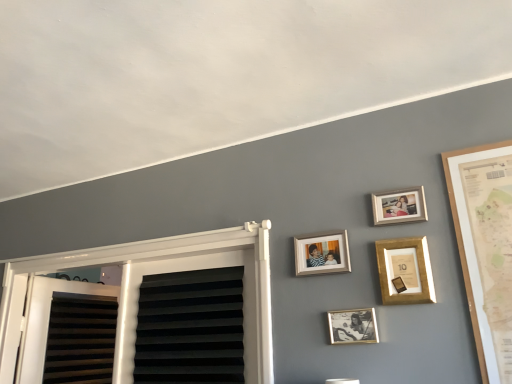
Question: Is gold-framed photo at center, arranged as the 4th picture frame when viewed from the top, positioned behind wooden photo frame at upper right, acting as the first picture frame starting from the top?

Choices:
 (A) yes
 (B) no

Answer: (B)

Question: Considering the relative positions of gold-framed photo at center, acting as the first picture frame starting from the bottom, and wooden photo frame at upper right, placed as the 4th picture frame when sorted from bottom to top, in the image provided, is gold-framed photo at center, acting as the first picture frame starting from the bottom, to the right of wooden photo frame at upper right, placed as the 4th picture frame when sorted from bottom to top, from the viewer's perspective?

Choices:
 (A) no
 (B) yes

Answer: (A)

Question: From the image's perspective, is gold-framed photo at center, arranged as the 4th picture frame when viewed from the top, located beneath wooden photo frame at upper right, placed as the 4th picture frame when sorted from bottom to top?

Choices:
 (A) no
 (B) yes

Answer: (B)

Question: Is gold-framed photo at center, acting as the first picture frame starting from the bottom, smaller than wooden photo frame at upper right, placed as the 4th picture frame when sorted from bottom to top?

Choices:
 (A) no
 (B) yes

Answer: (B)

Question: From a real-world perspective, is gold-framed photo at center, acting as the first picture frame starting from the bottom, below wooden photo frame at upper right, acting as the first picture frame starting from the top?

Choices:
 (A) yes
 (B) no

Answer: (A)

Question: Is point (333, 246) positioned closer to the camera than point (404, 216)?

Choices:
 (A) closer
 (B) farther

Answer: (B)

Question: Considering their positions, is wooden photo frame at center, the 2th picture frame when ordered from top to bottom, located in front of or behind wooden photo frame at upper right, acting as the first picture frame starting from the top?

Choices:
 (A) front
 (B) behind

Answer: (B)

Question: From the image's perspective, is wooden photo frame at center, placed as the 3th picture frame when sorted from bottom to top, above or below wooden photo frame at upper right, acting as the first picture frame starting from the top?

Choices:
 (A) below
 (B) above

Answer: (A)

Question: In the image, is wooden photo frame at center, placed as the 3th picture frame when sorted from bottom to top, on the left side or the right side of wooden photo frame at upper right, placed as the 4th picture frame when sorted from bottom to top?

Choices:
 (A) right
 (B) left

Answer: (B)

Question: Is gold metallic picture frame at upper center, acting as the second picture frame starting from the bottom, in front of or behind gold-framed photo at center, acting as the first picture frame starting from the bottom, in the image?

Choices:
 (A) behind
 (B) front

Answer: (B)

Question: Is point (419, 271) positioned closer to the camera than point (371, 309)?

Choices:
 (A) closer
 (B) farther

Answer: (A)

Question: Is gold metallic picture frame at upper center, acting as the second picture frame starting from the bottom, bigger or smaller than gold-framed photo at center, arranged as the 4th picture frame when viewed from the top?

Choices:
 (A) small
 (B) big

Answer: (B)

Question: Is gold metallic picture frame at upper center, which is counted as the third picture frame, starting from the top, inside the boundaries of gold-framed photo at center, acting as the first picture frame starting from the bottom, or outside?

Choices:
 (A) inside
 (B) outside

Answer: (B)

Question: Is wooden photo frame at upper right, acting as the first picture frame starting from the top, in front of or behind wooden photo frame at center, placed as the 3th picture frame when sorted from bottom to top, in the image?

Choices:
 (A) front
 (B) behind

Answer: (A)

Question: Visually, is wooden photo frame at upper right, acting as the first picture frame starting from the top, positioned to the left or to the right of wooden photo frame at center, the 2th picture frame when ordered from top to bottom?

Choices:
 (A) right
 (B) left

Answer: (A)